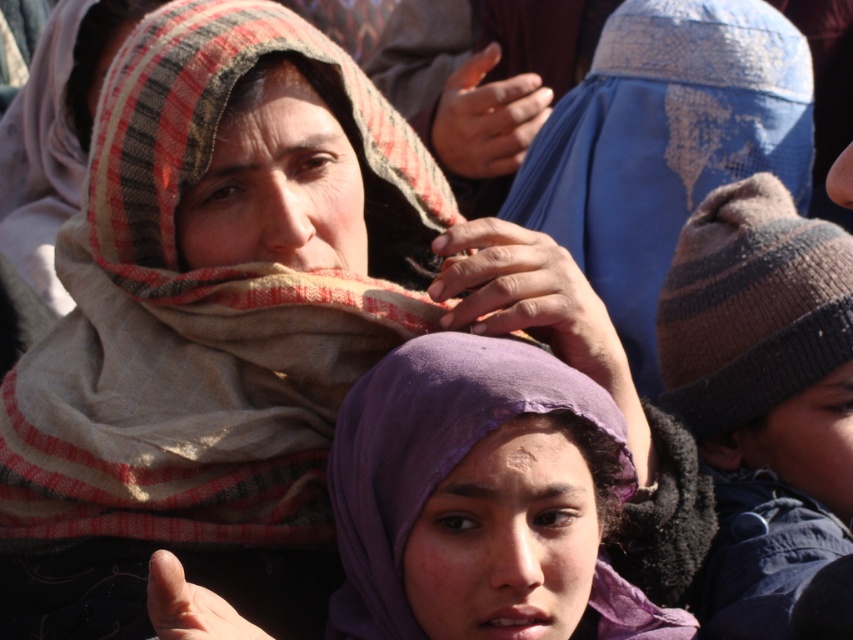
You are observing two hands in the image. The dry skin hand at center and the skinny flesh hand at lower left. Which hand is positioned higher?

The dry skin hand at center is positioned higher than the skinny flesh hand at lower left.

Consider the image. You are a photographer trying to capture a closeup of the knitted woolen hat at right and the skinny flesh hand at lower left. Which object should you zoom in on first to ensure it fits entirely within the frame?

The knitted woolen hat at right is taller than the skinny flesh hand at lower left, so you should zoom in on the knitted woolen hat at right first to ensure it fits entirely within the frame.

You are a photographer trying to capture a clear shot of the purple fabric headscarf at center. However, there is a knitted woolen hat at right in the way. Based on their positions, can you adjust your angle to avoid the hat while still framing the headscarf?

The knitted woolen hat at right is positioned over the purple fabric headscarf at center, so adjusting your angle downward might allow you to capture the headscarf without the hat obstructing it.